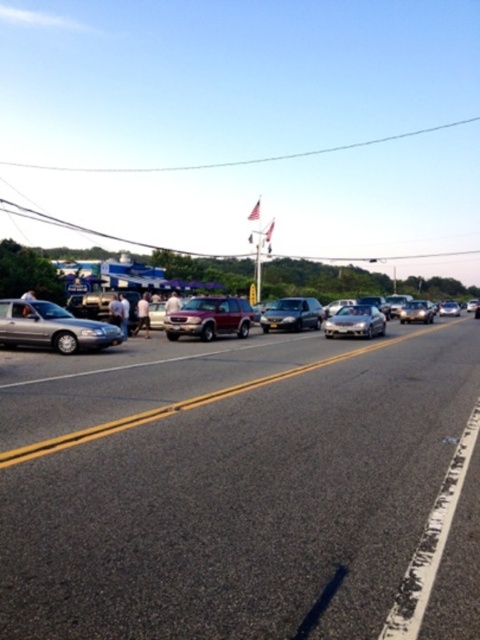
Which is more to the right, satin burgundy suv at center or satin silver sedan at center?

satin silver sedan at center

Does satin burgundy suv at center have a larger size compared to satin silver sedan at center?

Incorrect, satin burgundy suv at center is not larger than satin silver sedan at center.

You are a GUI agent. You are given a task and a screenshot of the screen. Output one action in this format:
    pyautogui.click(x=<x>, y=<y>)
    Task: Click on the satin burgundy suv at center
    The height and width of the screenshot is (640, 480).
    Given the screenshot: What is the action you would take?
    pyautogui.click(x=210, y=317)

Can you confirm if satin burgundy suv at center is positioned below satin silver car at center?

Yes.

Is satin burgundy suv at center to the left of satin silver car at center from the viewer's perspective?

Correct, you'll find satin burgundy suv at center to the left of satin silver car at center.

Does point (187, 301) come in front of point (350, 321)?

Yes, it is in front of point (350, 321).

Identify the location of satin burgundy suv at center. (210, 317).

Which is in front, point (10, 326) or point (400, 316)?

Positioned in front is point (10, 326).

Is point (82, 333) more distant than point (408, 312)?

No.

Is point (1, 332) farther from camera compared to point (428, 320)?

No, it is in front of (428, 320).

This screenshot has width=480, height=640. I want to click on silver metallic sedan at left, so click(x=52, y=326).